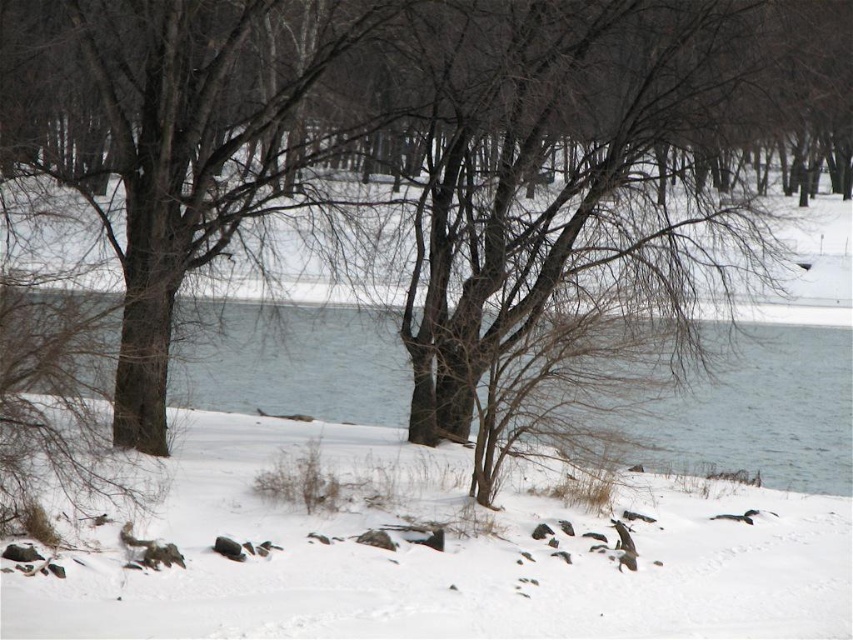
Question: Can you confirm if white fluffy snow at center is positioned to the right of clear water at center?

Choices:
 (A) no
 (B) yes

Answer: (A)

Question: Which point is closer to the camera?

Choices:
 (A) clear water at center
 (B) white fluffy snow at center

Answer: (B)

Question: Is white fluffy snow at center thinner than clear water at center?

Choices:
 (A) yes
 (B) no

Answer: (A)

Question: From the image, what is the correct spatial relationship of white fluffy snow at center in relation to clear water at center?

Choices:
 (A) right
 (B) left

Answer: (B)